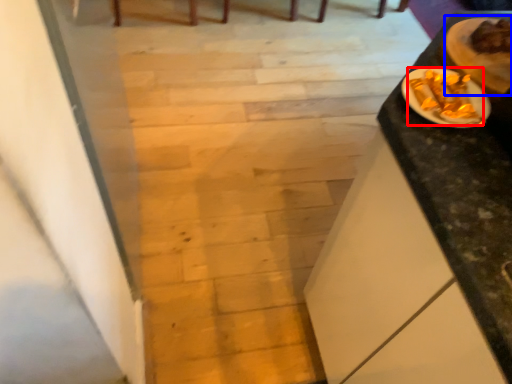
Question: Among these objects, which one is nearest to the camera, food (highlighted by a red box) or food (highlighted by a blue box)?

Choices:
 (A) food
 (B) food

Answer: (A)